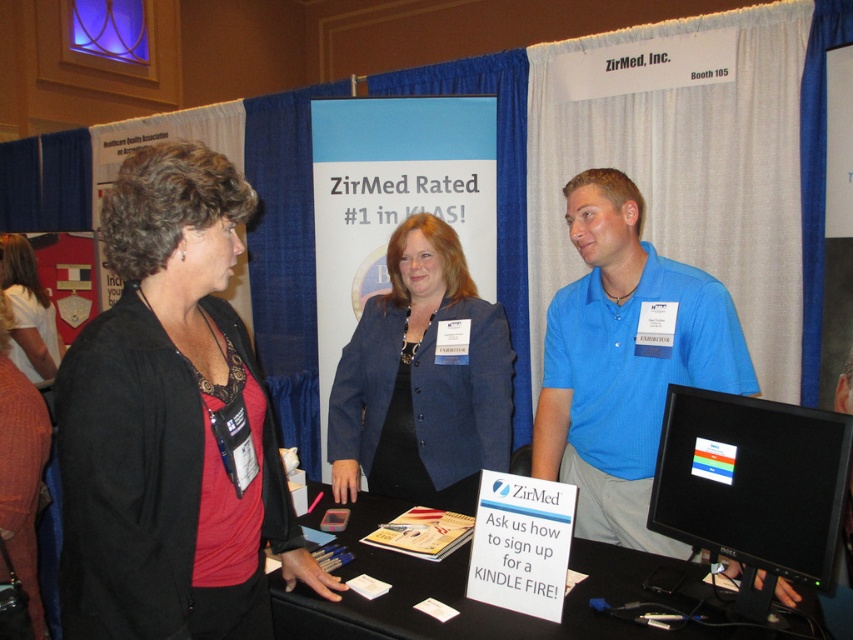
You are standing at the entrance of the ZirMed booth and notice the blue shirt at center and the black glossy monitor at right. Which object is wider from your perspective?

The blue shirt at center might be wider than the black glossy monitor at right according to the description.

You are standing in front of the ZirMed booth. There are two points marked in the image. One is at coordinate point (724,400) and the other is at (679,602). Which point is closer to you?

The point at coordinate (724,400) is closer to you than the point at (679,602).